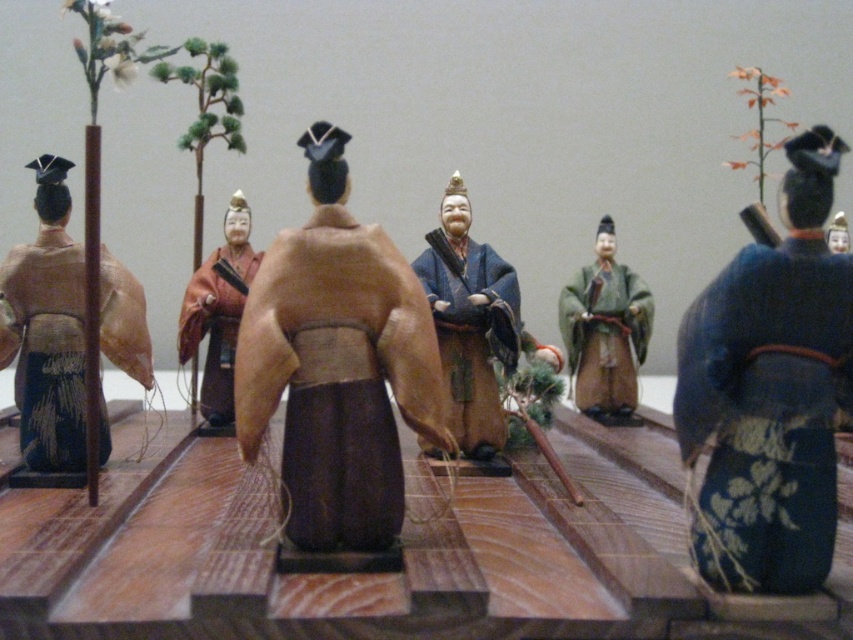
Can you confirm if brown matte kimono at center is positioned to the right of blue silk robe at center?

Incorrect, brown matte kimono at center is not on the right side of blue silk robe at center.

Can you confirm if brown matte kimono at center is positioned below blue silk robe at center?

No, brown matte kimono at center is not below blue silk robe at center.

Does point (325, 225) come behind point (486, 336)?

No.

The width and height of the screenshot is (853, 640). Identify the location of brown matte kimono at center. (337, 364).

Between brown matte kimono at center and matte brown robe at center, which one appears on the right side from the viewer's perspective?

From the viewer's perspective, brown matte kimono at center appears more on the right side.

Describe the element at coordinates (337, 364) in the screenshot. I see `brown matte kimono at center` at that location.

Who is more forward, (392, 474) or (215, 406)?

Positioned in front is point (392, 474).

You are a GUI agent. You are given a task and a screenshot of the screen. Output one action in this format:
    pyautogui.click(x=<x>, y=<y>)
    Task: Click on the brown matte kimono at center
    The image size is (853, 640).
    Given the screenshot: What is the action you would take?
    [337, 364]

Is blue silk kimono at right positioned at the back of green matte kimono at center?

That is False.

Is point (787, 460) farther from camera compared to point (622, 275)?

No, it is not.

Where is `blue silk kimono at right`? blue silk kimono at right is located at coordinates (770, 392).